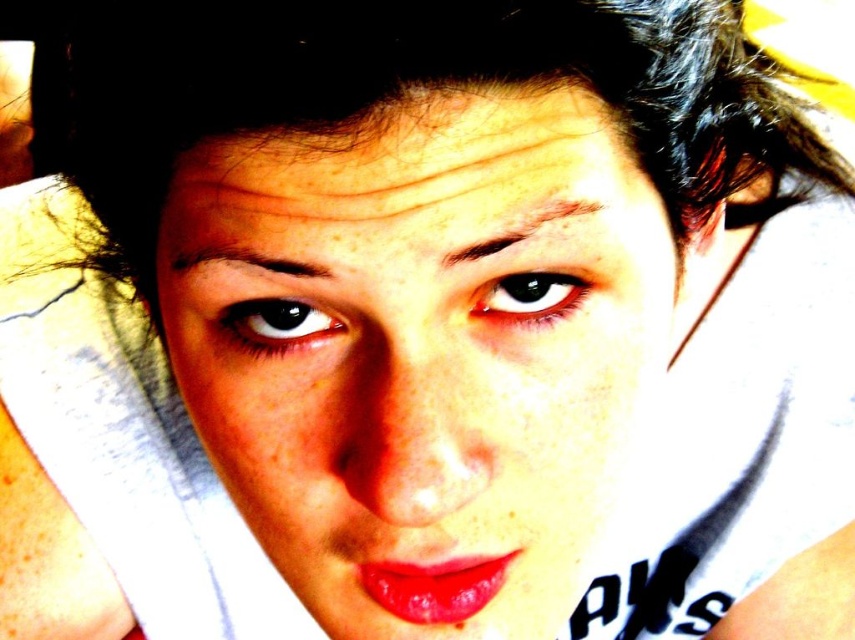
Can you confirm if dark brown hair at upper center is positioned below black glossy eye at upper left?

Actually, dark brown hair at upper center is above black glossy eye at upper left.

Identify the location of dark brown hair at upper center. The image size is (855, 640). (394, 90).

This screenshot has height=640, width=855. Identify the location of dry skin at center. (416, 161).

I want to click on dry skin at center, so click(416, 161).

Who is more distant from viewer, (234, 420) or (407, 164)?

The point (234, 420) is more distant.

Is smooth skin face at center bigger than dry skin at center?

Yes.

At what (x,y) coordinates should I click in order to perform the action: click on smooth skin face at center. Please return your answer as a coordinate pair (x, y). The image size is (855, 640). Looking at the image, I should click on (422, 349).